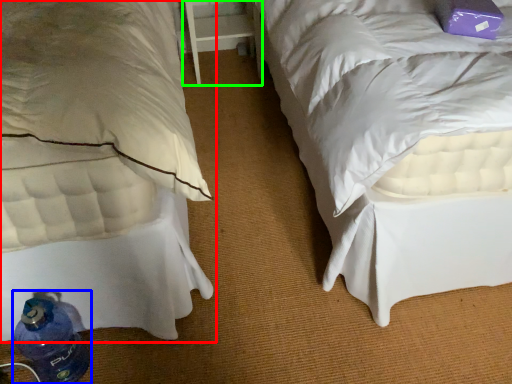
Question: Estimate the real-world distances between objects in this image. Which object is farther from bed (highlighted by a red box), bottle (highlighted by a blue box) or table (highlighted by a green box)?

Choices:
 (A) bottle
 (B) table

Answer: (B)